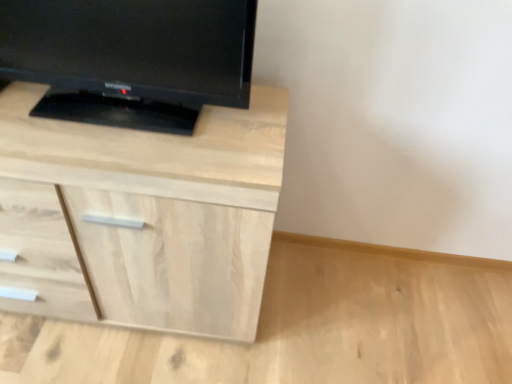
Identify the location of free point to the right of light wood chest of drawers at upper left. The image size is (512, 384). [322, 321].